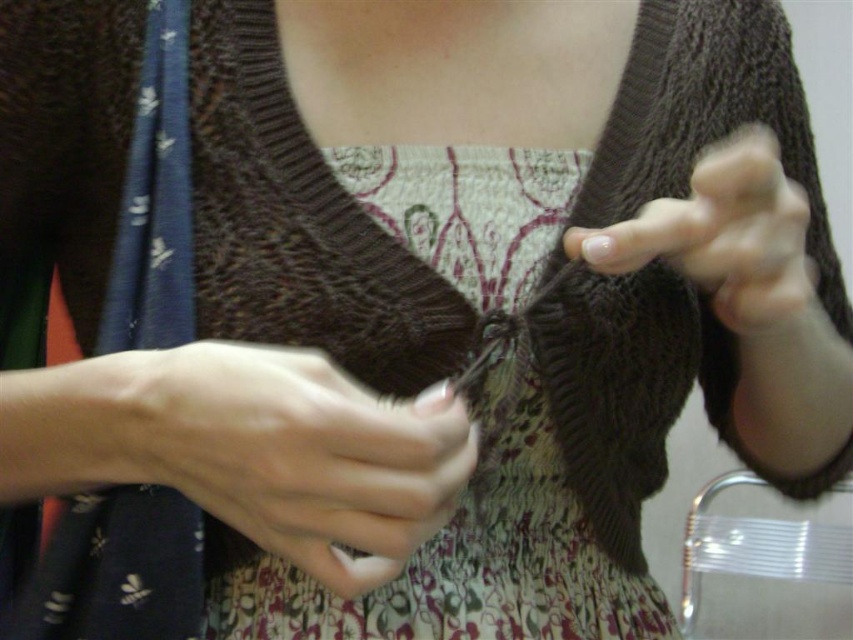
You are a photographer trying to capture the hands of the person knitting. The camera is positioned at the point indicated by point [300,456]. What is the subject of the photo you are taking?

The point [300,456] indicates white matte skin at center, so the subject of the photo is the hands of the person knitting.

You are a photographer taking a closeup shot of someone knitting. You notice the white matte skin at center and the nail polish at center. Which object is positioned to the right in the image?

The nail polish at center is positioned to the right of the white matte skin at center.